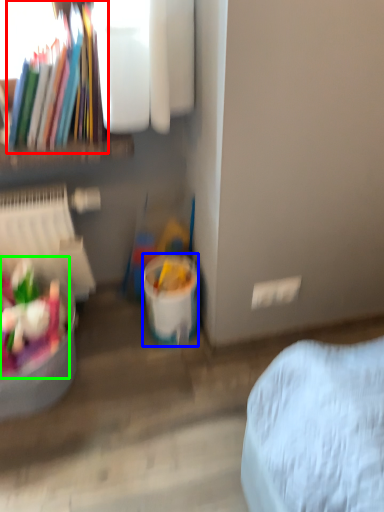
Question: Which is farther away from book (highlighted by a red box)? bucket (highlighted by a blue box) or food (highlighted by a green box)?

Choices:
 (A) bucket
 (B) food

Answer: (A)